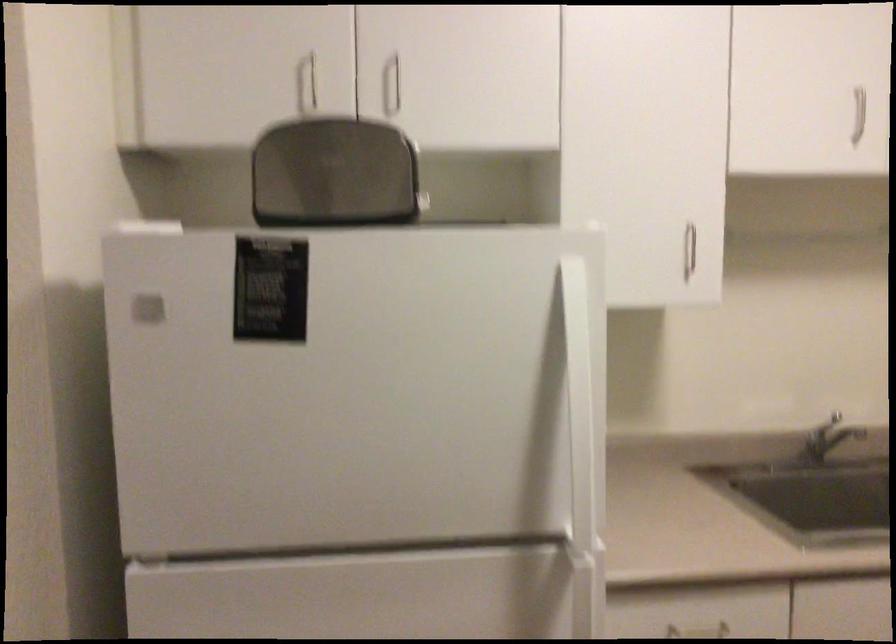
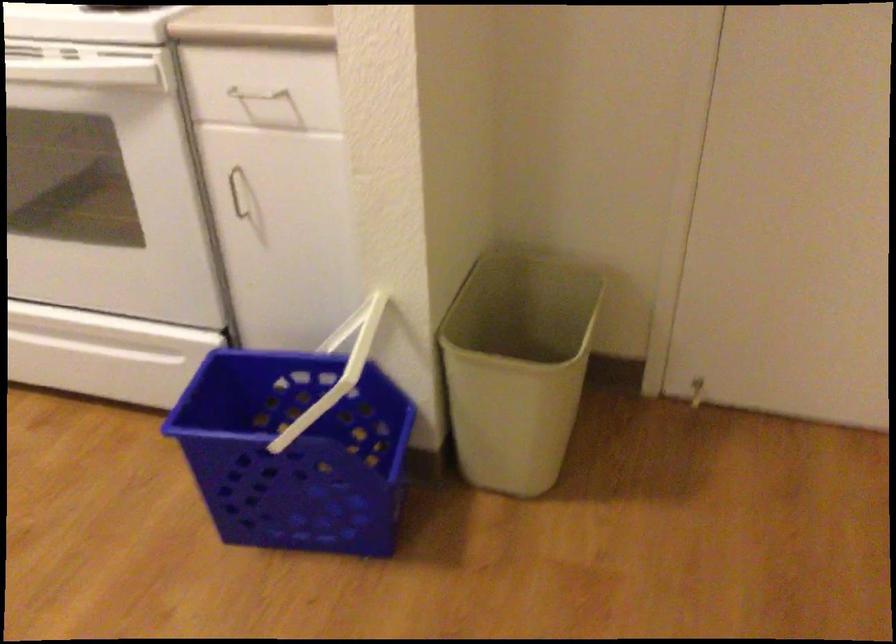
How did the camera likely rotate?

The camera's rotation is toward right-down.